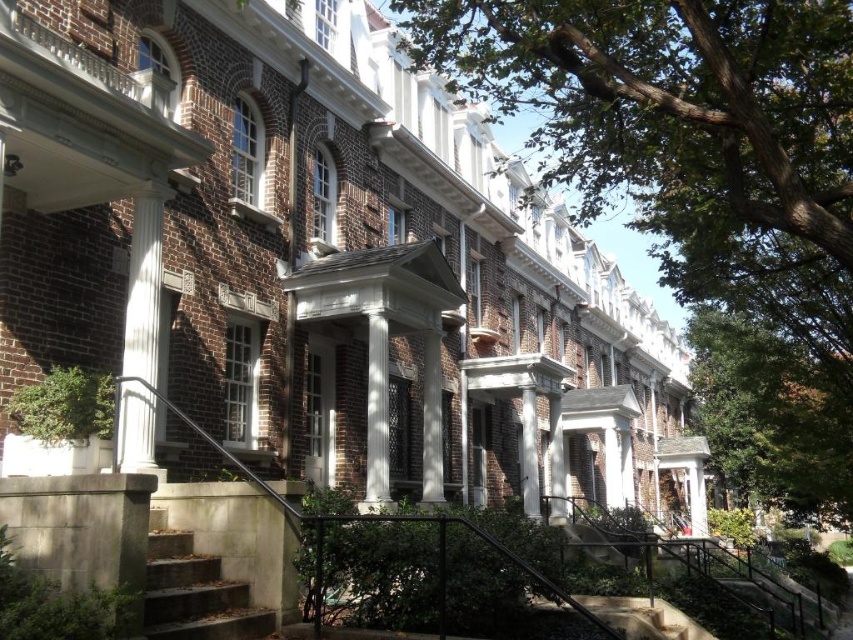
You are an architect inspecting the building facade. You notice the white glossy column at left and the white smooth column at center. Which column is positioned higher on the building facade?

The white glossy column at left is located above the white smooth column at center, so it is positioned higher on the building facade.

You are standing in front of the row of brick buildings and want to determine the relative positions of two points marked on the facade. Which point is closer to you, point at coordinate (791, 113) or point at coordinate (204, 593)?

Point at coordinate (791, 113) is closer to you than point at coordinate (204, 593) because it is further to the viewer according to the description.